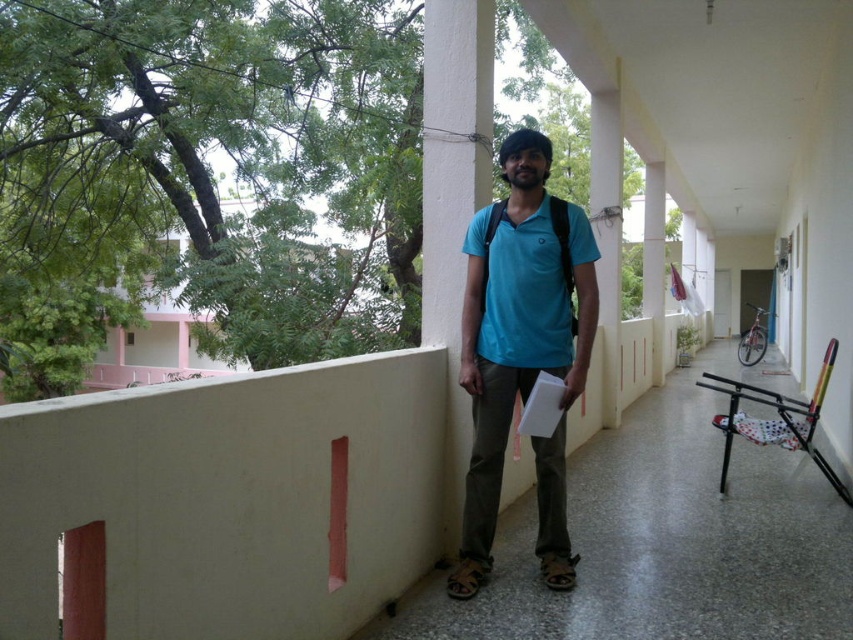
Which is behind, point (535, 353) or point (457, 16)?

The point (457, 16) is behind.

Is matte blue shirt at center positioned behind white smooth pillar at center?

No.

Image resolution: width=853 pixels, height=640 pixels. Find the location of `matte blue shirt at center`. matte blue shirt at center is located at coordinates (521, 349).